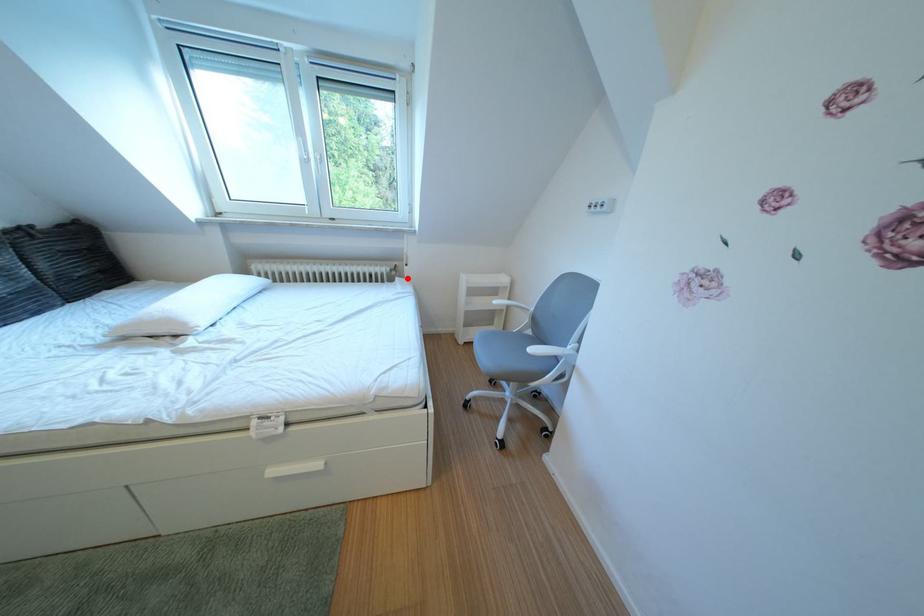
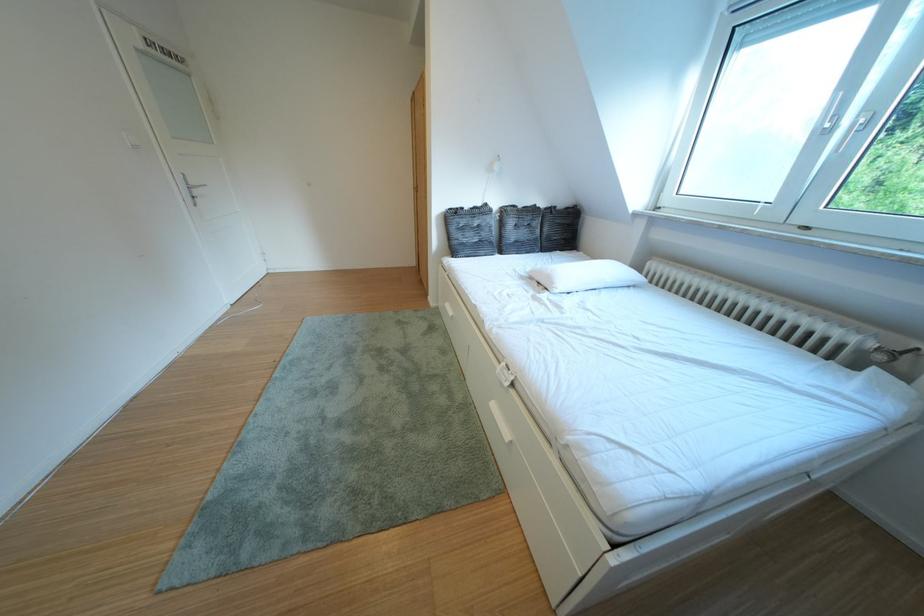
The point at the highlighted location is marked in the first image. Where is the corresponding point in the second image?

(893, 363)